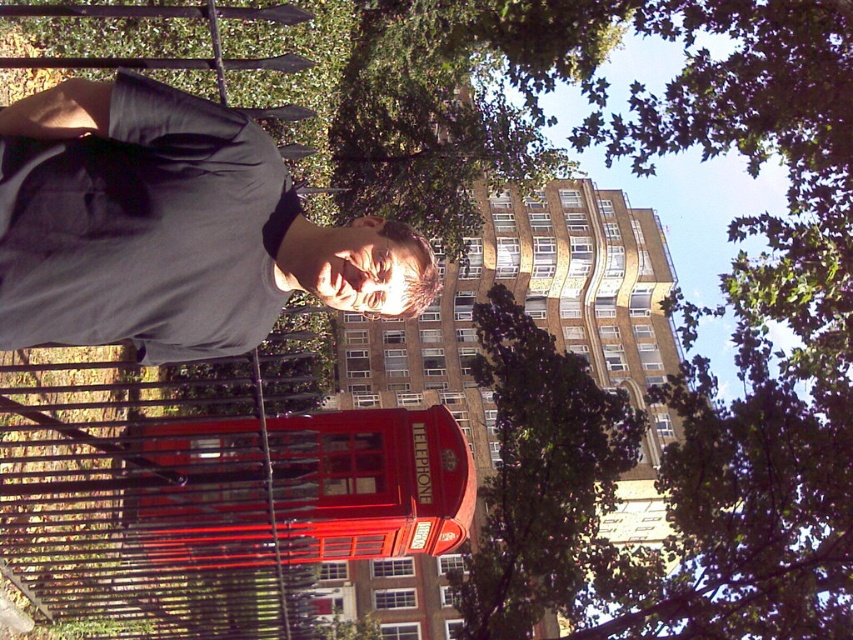
Question: Can you confirm if matte gray t-shirt at upper left is positioned above green leafy tree at center?

Choices:
 (A) yes
 (B) no

Answer: (A)

Question: Does matte gray t-shirt at upper left appear on the right side of green leafy tree at center?

Choices:
 (A) no
 (B) yes

Answer: (A)

Question: Considering the relative positions of matte gray t-shirt at upper left and green leafy tree at center in the image provided, where is matte gray t-shirt at upper left located with respect to green leafy tree at center?

Choices:
 (A) above
 (B) below

Answer: (A)